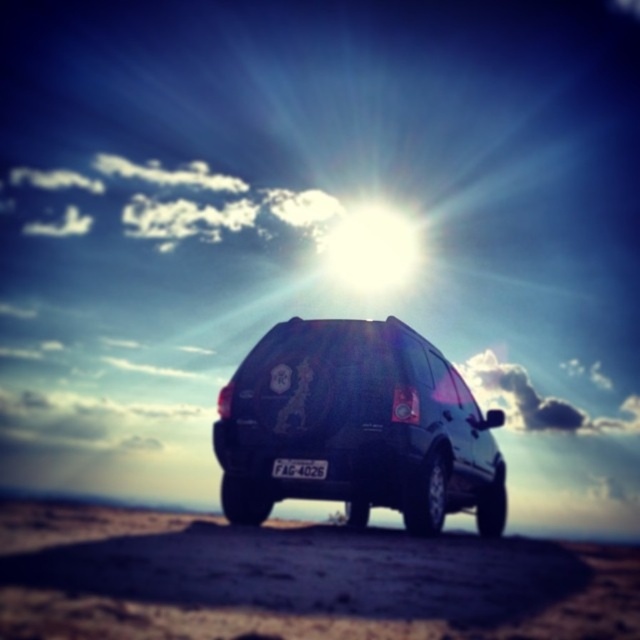
You are a drone operator trying to navigate between two points in the scene. The first point is point (52,625) and the second point is point (428,467). From the perspective of the vehicle, which direction should you fly the drone to move from the first point to the second point?

To move from point (52,625) to point (428,467), you should fly the drone towards the rear of the vehicle since point (52,625) is in front of point (428,467) relative to the vehicle.